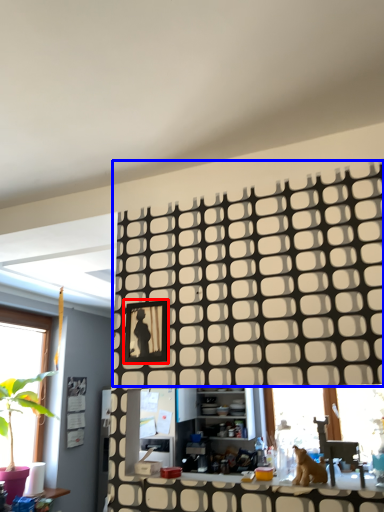
Question: Which point is further to the camera, picture frame (highlighted by a red box) or pattern (highlighted by a blue box)?

Choices:
 (A) picture frame
 (B) pattern

Answer: (A)